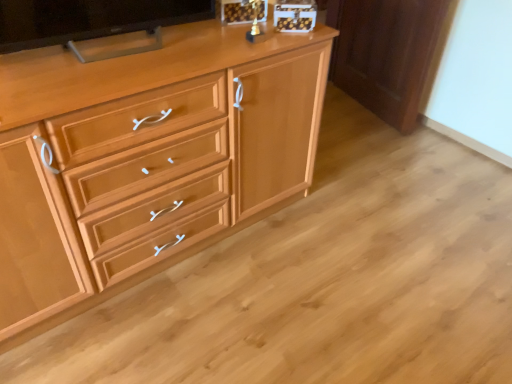
Identify the location of free area below matte black tv at upper left (from a real-world perspective). This screenshot has height=384, width=512. (110, 46).